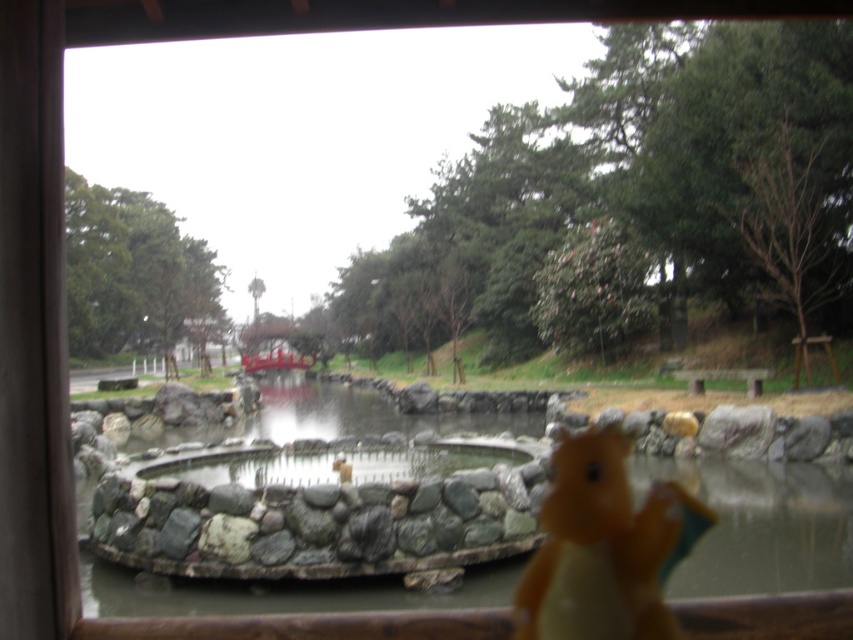
Is smooth stone pond at center thinner than yellow rubber duck at lower right?

No.

Between smooth stone pond at center and yellow rubber duck at lower right, which one appears on the left side from the viewer's perspective?

Positioned to the left is smooth stone pond at center.

Find the location of `smooth stone pond at center`. smooth stone pond at center is located at coordinates (291, 490).